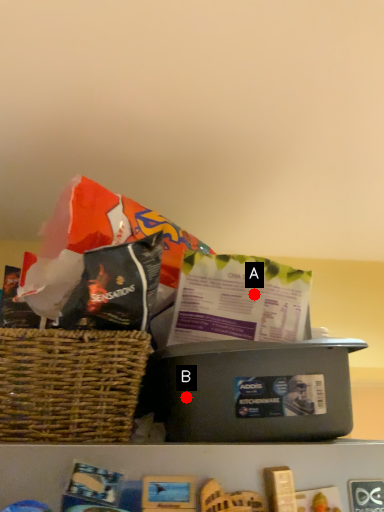
Question: Two points are circled on the image, labeled by A and B beside each circle. Which point is farther to the camera?

Choices:
 (A) A is further
 (B) B is further

Answer: (A)